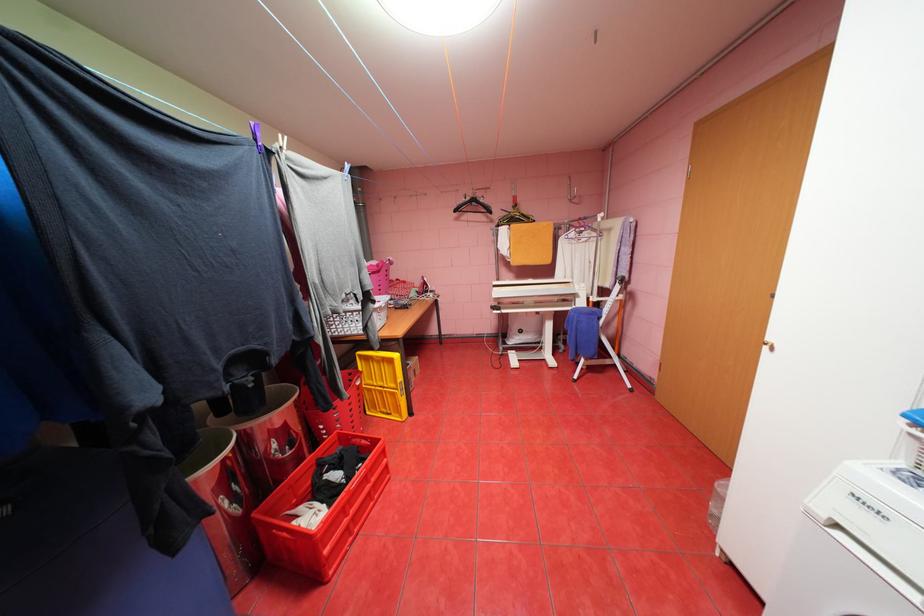
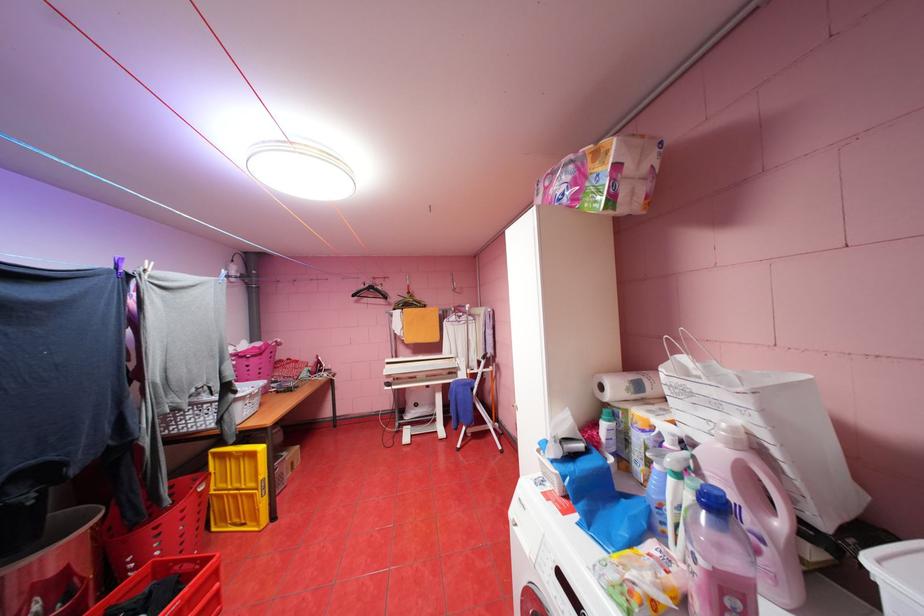
In the second image, find the point that corresponds to point 355,395 in the first image.

(176, 501)